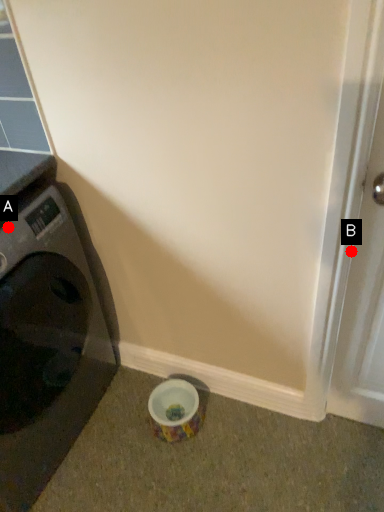
Question: Two points are circled on the image, labeled by A and B beside each circle. Which point is closer to the camera?

Choices:
 (A) A is closer
 (B) B is closer

Answer: (B)